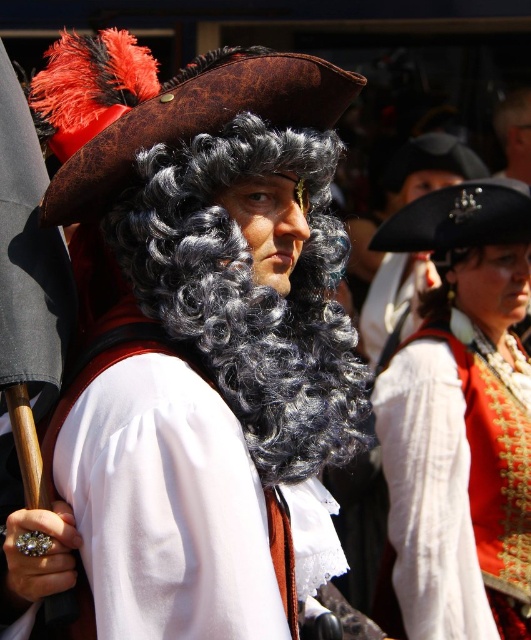
Consider the image. Does curly black wig at center come behind black curly wig at upper right?

No, it is in front of black curly wig at upper right.

Is curly black wig at center positioned before black curly wig at upper right?

Yes, curly black wig at center is in front of black curly wig at upper right.

Does point (270, 324) come behind point (438, 324)?

No.

At what (x,y) coordinates should I click in order to perform the action: click on curly black wig at center. Please return your answer as a coordinate pair (x, y). Looking at the image, I should click on (250, 289).

Describe the element at coordinates (494, 480) in the screenshot. This screenshot has width=531, height=640. I see `white satin vest at center` at that location.

Does white satin vest at center have a greater width compared to black curly wig at upper right?

Yes.

Is point (518, 467) in front of point (477, 260)?

That is True.

Locate an element on the screen. This screenshot has width=531, height=640. white satin vest at center is located at coordinates (494, 480).

Is point (290, 440) positioned before point (500, 394)?

Yes, point (290, 440) is in front of point (500, 394).

Looking at this image, which is more to the left, curly black wig at center or white satin vest at center?

curly black wig at center

Measure the distance between curly black wig at center and camera.

They are 6.16 meters apart.

Find the location of a particular element. curly black wig at center is located at coordinates (250, 289).